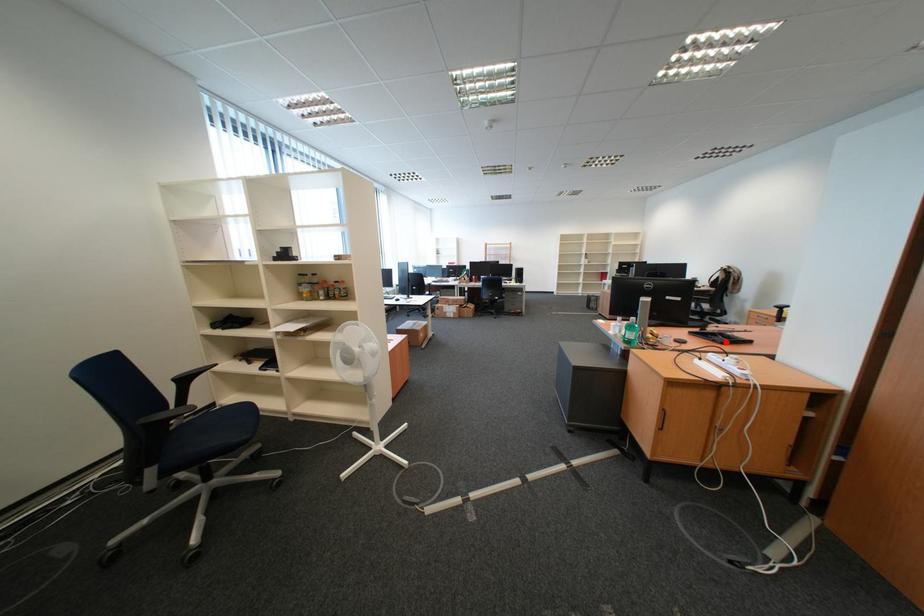
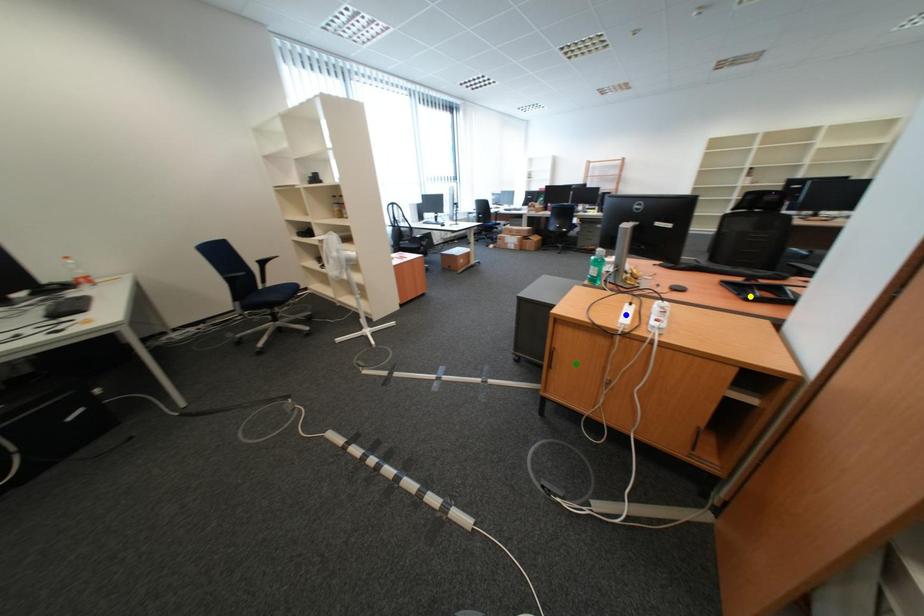
Question: I am providing you with two images of the same scene from different viewpoints. A red point is marked on the first image. You are given multiple points on the second image. Which point in image 2 represents the same 3d spot as the red point in image 1?

Choices:
 (A) blue point
 (B) green point
 (C) yellow point

Answer: (C)